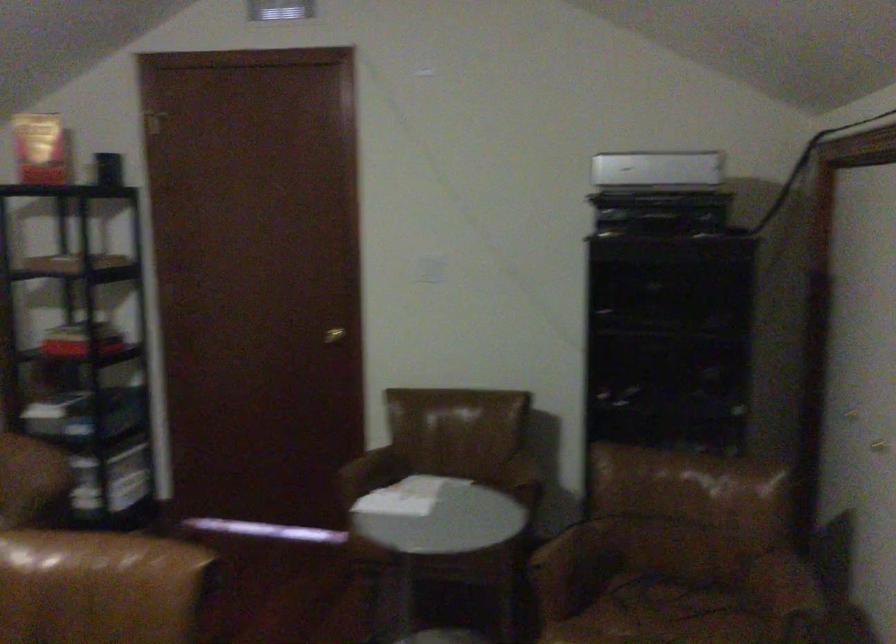
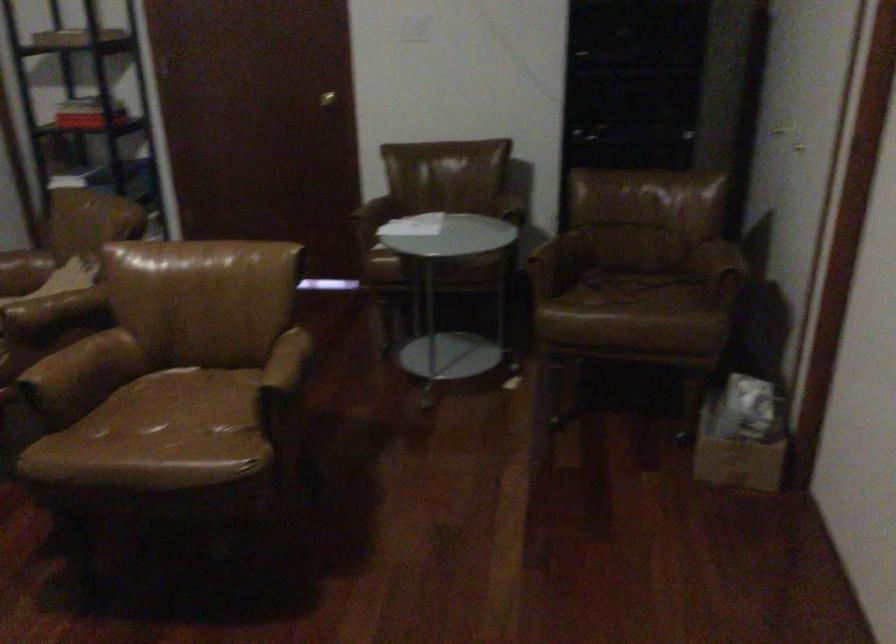
Which direction would the cameraman need to move to produce the second image?

→ The movement direction of the cameraman is left, backward.